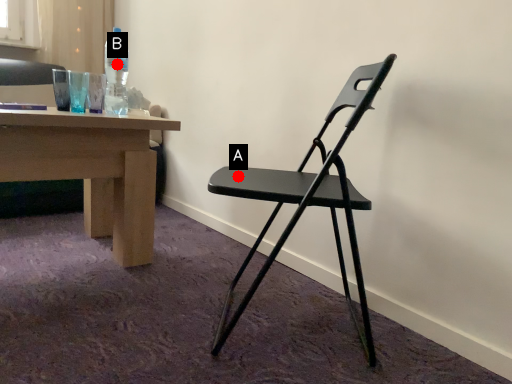
Question: Two points are circled on the image, labeled by A and B beside each circle. Which point is closer to the camera?

Choices:
 (A) A is closer
 (B) B is closer

Answer: (A)